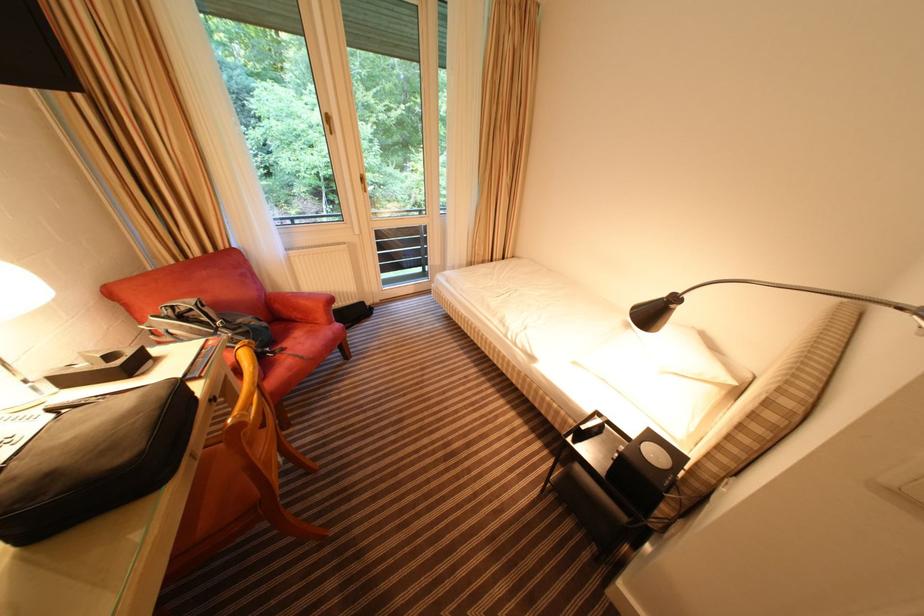
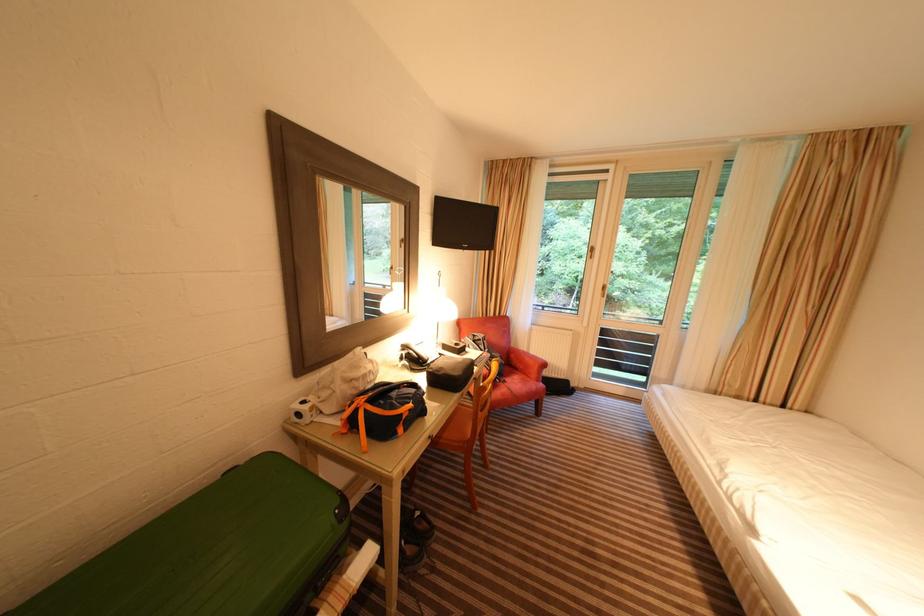
Where in the second image is the point corresponding to point (284, 308) from the first image?

(518, 358)